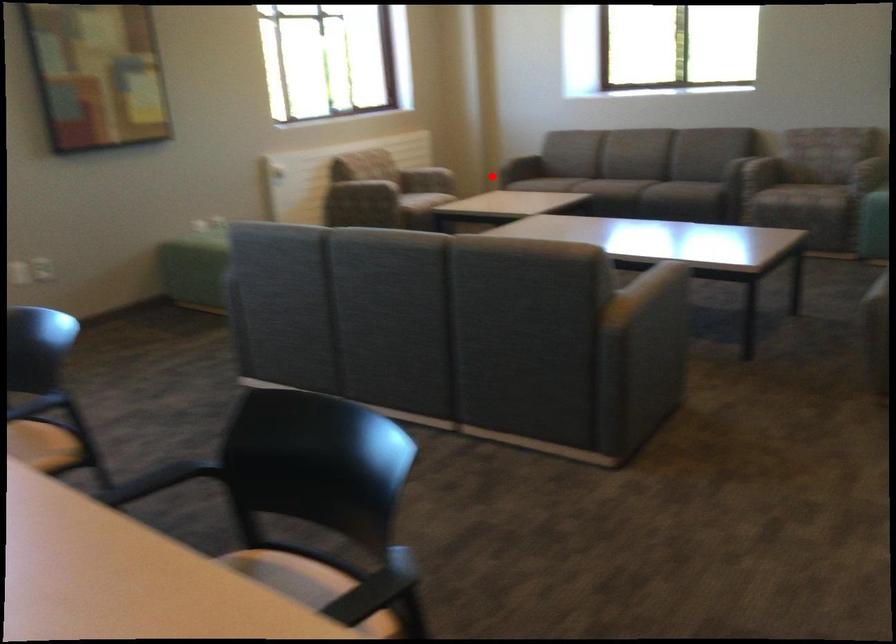
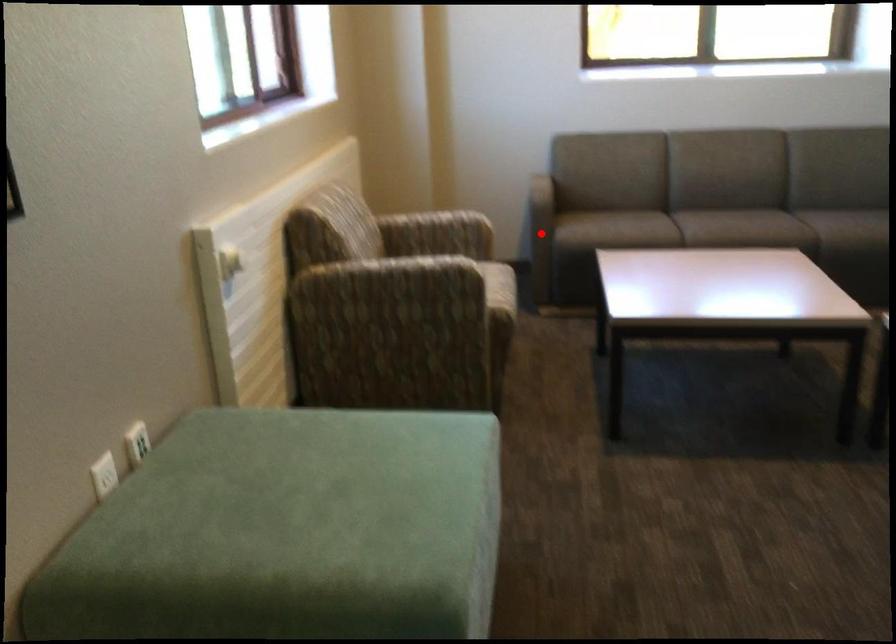
I am providing you with two images of the same scene from different viewpoints. A red point is marked on the first image and another point is marked on the second image. Are the points marked in image1 and image2 representing the same 3D position?

Yes